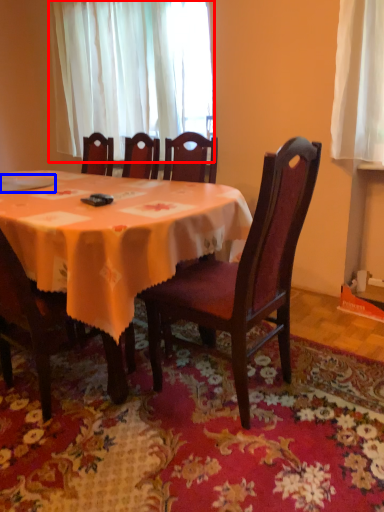
Question: Among these objects, which one is farthest to the camera, curtain (highlighted by a red box) or tableware (highlighted by a blue box)?

Choices:
 (A) curtain
 (B) tableware

Answer: (A)